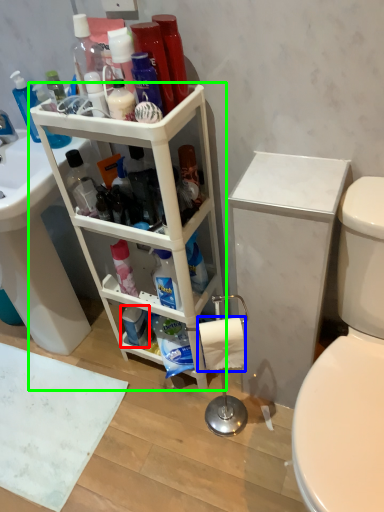
Question: Based on their relative distances, which object is farther from toiletry (highlighted by a red box)? Choose from toilet paper (highlighted by a blue box) and shelf (highlighted by a green box).

Choices:
 (A) toilet paper
 (B) shelf

Answer: (A)